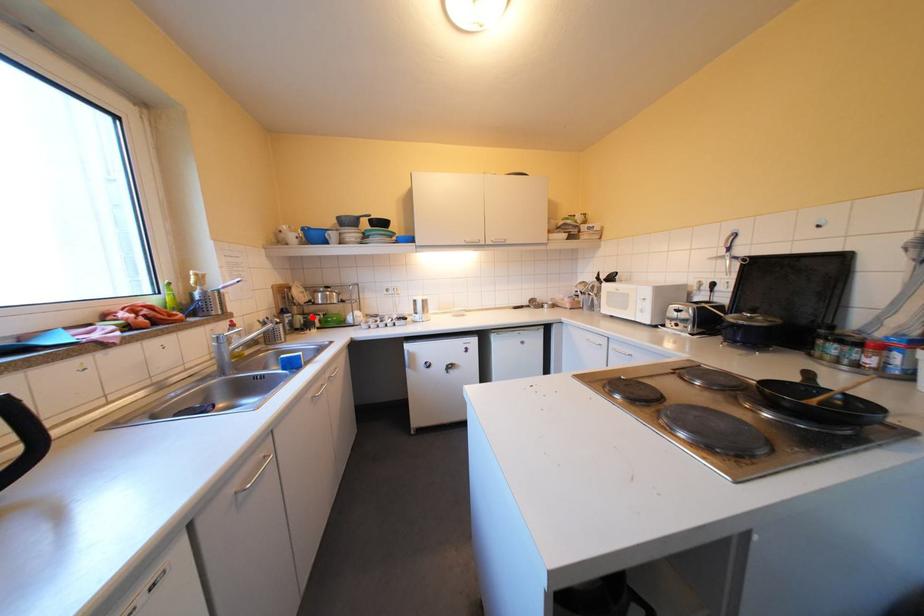
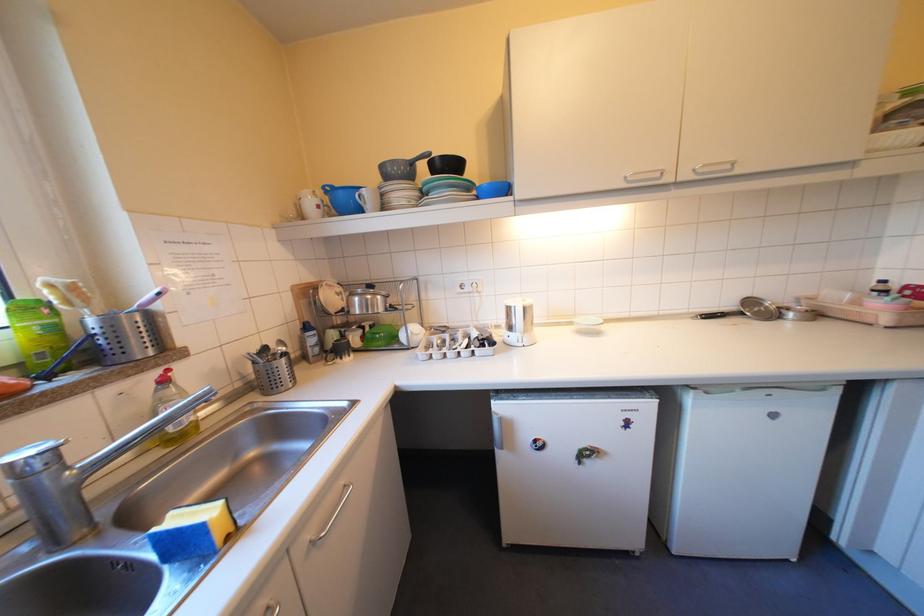
Locate, in the second image, the point that corresponds to the highlighted location in the first image.

(346, 334)